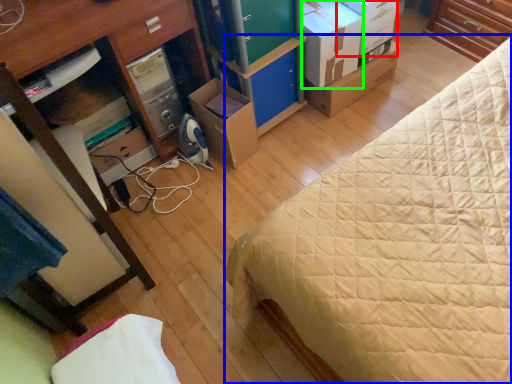
Question: Based on their relative distances, which object is farther from storage box (highlighted by a red box)? Choose from bed (highlighted by a blue box) and cardboard box (highlighted by a green box).

Choices:
 (A) bed
 (B) cardboard box

Answer: (A)